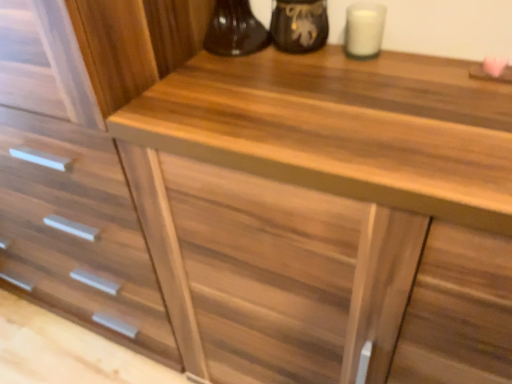
This screenshot has width=512, height=384. Describe the element at coordinates (298, 25) in the screenshot. I see `matte black vase at upper center` at that location.

What do you see at coordinates (364, 30) in the screenshot?
I see `white matte candle at upper right` at bounding box center [364, 30].

Where is `matte black vase at upper center`? matte black vase at upper center is located at coordinates (298, 25).

Is wooden drawer at center oriented towards matte black vase at upper center?

No, wooden drawer at center does not turn towards matte black vase at upper center.

Find the location of a particular element. The image size is (512, 384). appliance that appears behind the wooden drawer at center is located at coordinates (298, 25).

Looking at this image, do you think white matte candle at upper right is within wooden drawer at center, or outside of it?

The correct answer is: outside.

From a real-world perspective, which is physically above, white matte candle at upper right or wooden drawer at center?

white matte candle at upper right, from a real-world perspective.

Can you confirm if white matte candle at upper right is thinner than wooden drawer at center?

Yes.

Is white matte candle at upper right not close to wooden drawer at center?

white matte candle at upper right is actually quite close to wooden drawer at center.

How many degrees apart are the facing directions of white matte candle at upper right and matte black vase at upper center?

The angular difference between white matte candle at upper right and matte black vase at upper center is 0.00166 degrees.

From the image's perspective, relative to matte black vase at upper center, is white matte candle at upper right above or below?

Clearly, from the image's perspective, white matte candle at upper right is below matte black vase at upper center.

Is white matte candle at upper right directly adjacent to matte black vase at upper center?

Yes, white matte candle at upper right and matte black vase at upper center clearly make contact.

From the image's perspective, relative to white matte candle at upper right, is wooden drawer at center above or below?

Based on their image positions, wooden drawer at center is located beneath white matte candle at upper right.

Who is taller, wooden drawer at center or white matte candle at upper right?

With more height is wooden drawer at center.

Is wooden drawer at center facing away from white matte candle at upper right?

wooden drawer at center does not have its back to white matte candle at upper right.

Does wooden drawer at center contain white matte candle at upper right?

Definitely not — white matte candle at upper right is not inside wooden drawer at center.

Does point (271, 35) come in front of point (113, 238)?

Yes, point (271, 35) is in front of point (113, 238).

Would you consider matte black vase at upper center to be distant from wooden drawer at center?

That's not correct — matte black vase at upper center is a little close to wooden drawer at center.

Where is `appliance behind the wooden drawer at center`? This screenshot has width=512, height=384. appliance behind the wooden drawer at center is located at coordinates (298, 25).

From the image's perspective, is matte black vase at upper center under wooden drawer at center?

Actually, matte black vase at upper center appears above wooden drawer at center in the image.

Measure the distance between matte black vase at upper center and white matte candle at upper right.

matte black vase at upper center and white matte candle at upper right are 3.42 inches apart from each other.

From a real-world perspective, which is physically above, matte black vase at upper center or white matte candle at upper right?

In real-world perspective, matte black vase at upper center is above.

Is matte black vase at upper center located outside white matte candle at upper right?

matte black vase at upper center is positioned outside white matte candle at upper right.

Identify the location of drawer below the matte black vase at upper center (from a real-world perspective). (70, 209).

Find the location of `drawer in front of the white matte candle at upper right`. drawer in front of the white matte candle at upper right is located at coordinates (70, 209).

Which object lies nearer to the anchor point wooden drawer at center, white matte candle at upper right or matte black vase at upper center?

matte black vase at upper center is positioned closer to the anchor wooden drawer at center.

Based on their spatial positions, is white matte candle at upper right or wooden drawer at center closer to matte black vase at upper center?

white matte candle at upper right.

Considering their positions, is matte black vase at upper center positioned closer to white matte candle at upper right than wooden drawer at center?

The object closer to white matte candle at upper right is matte black vase at upper center.

Estimate the real-world distances between objects in this image. Which object is further from matte black vase at upper center, wooden drawer at center or white matte candle at upper right?

wooden drawer at center.

Considering their positions, is wooden drawer at center positioned closer to white matte candle at upper right than matte black vase at upper center?

matte black vase at upper center is positioned closer to the anchor white matte candle at upper right.

Looking at the image, which one is located further to wooden drawer at center, matte black vase at upper center or white matte candle at upper right?

white matte candle at upper right is positioned further to the anchor wooden drawer at center.

Image resolution: width=512 pixels, height=384 pixels. I want to click on appliance located between wooden drawer at center and white matte candle at upper right in the left-right direction, so click(x=298, y=25).